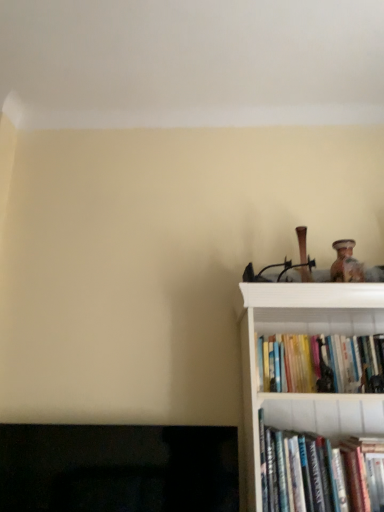
The width and height of the screenshot is (384, 512). What do you see at coordinates (321, 364) in the screenshot? I see `hardcover books at right` at bounding box center [321, 364].

Where is `hardcover books at right`? The image size is (384, 512). hardcover books at right is located at coordinates (321, 364).

At what (x,y) coordinates should I click in order to perform the action: click on hardcover books at right. Please return your answer as a coordinate pair (x, y). This screenshot has width=384, height=512. Looking at the image, I should click on (321, 364).